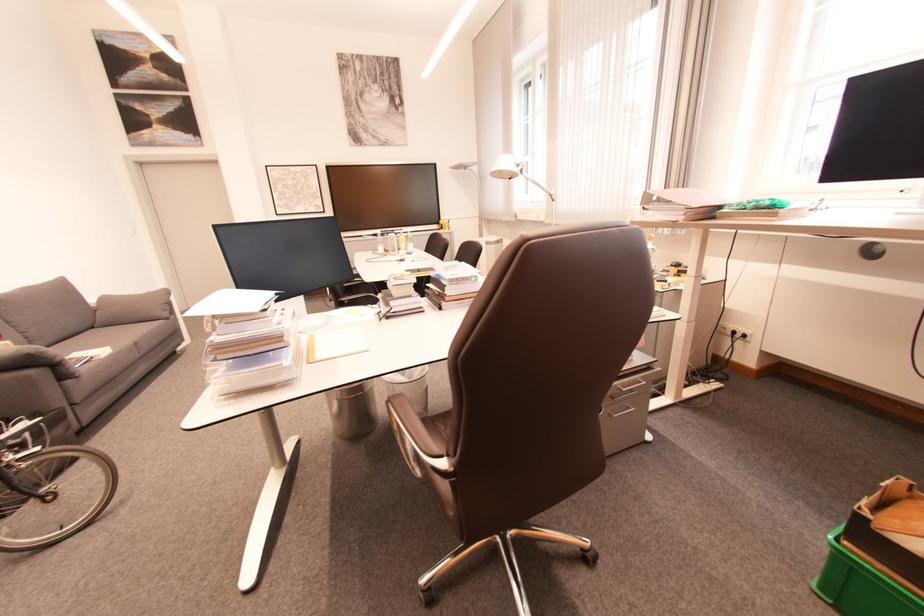
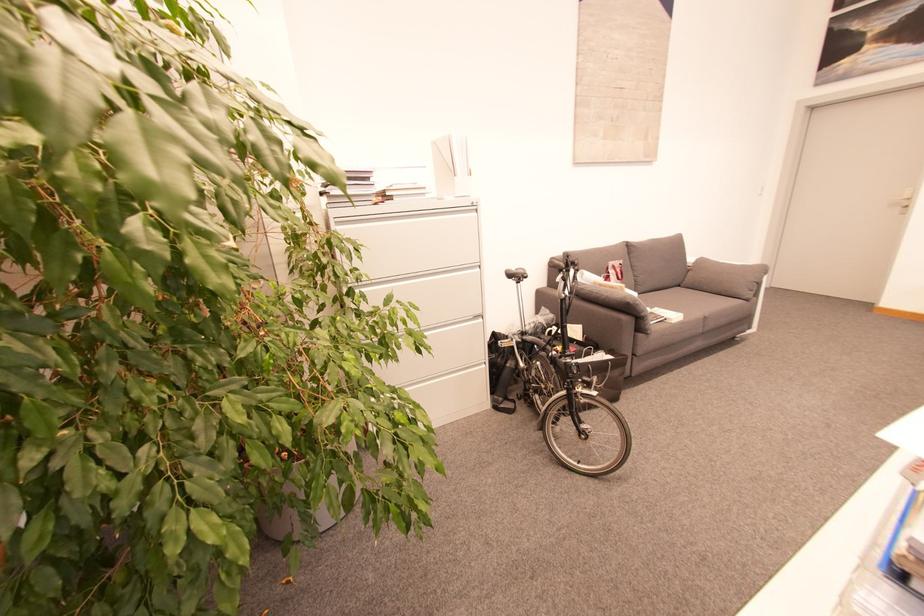
The first image is from the beginning of the video and the second image is from the end. How did the camera likely rotate when shooting the video?

The rotation direction of the camera is left-down.